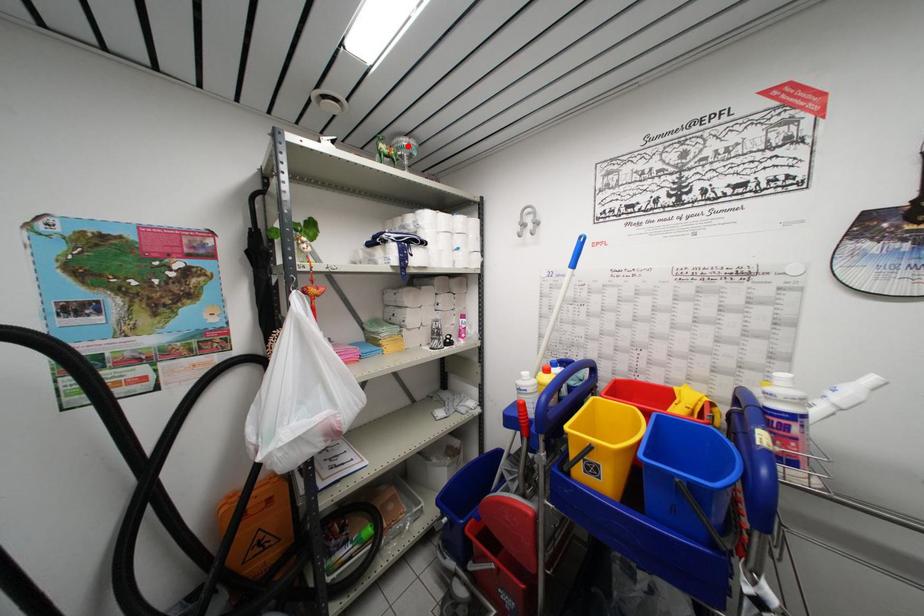
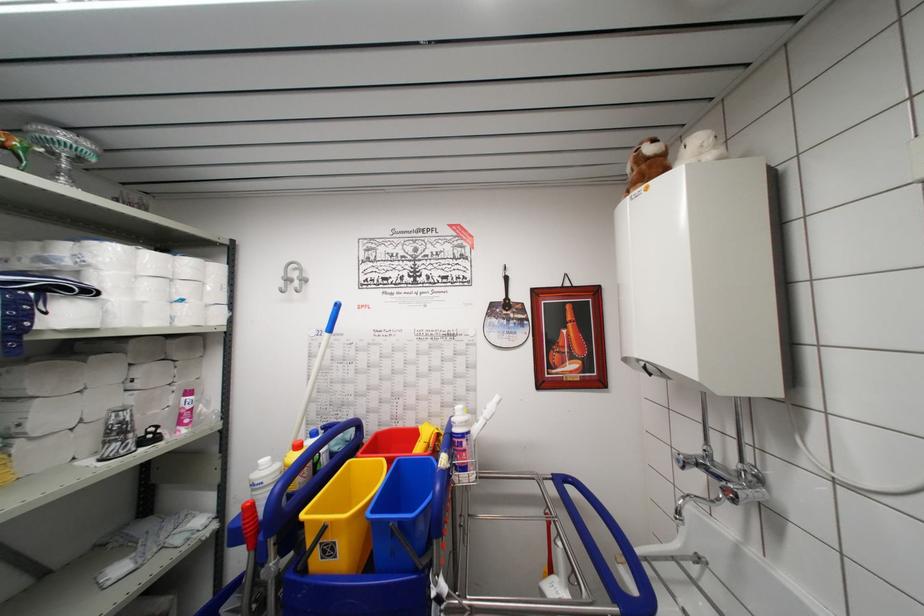
Find the pixel in the second image that matches the highlighted location in the first image.

(67, 140)